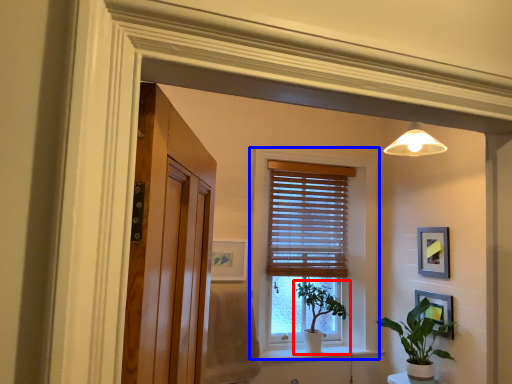
Question: Which of the following is the farthest to the observer, houseplant (highlighted by a red box) or window (highlighted by a blue box)?

Choices:
 (A) houseplant
 (B) window

Answer: (A)